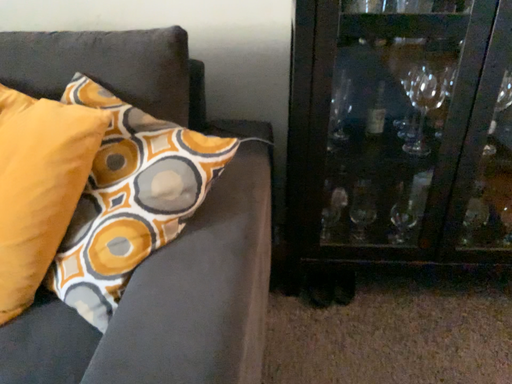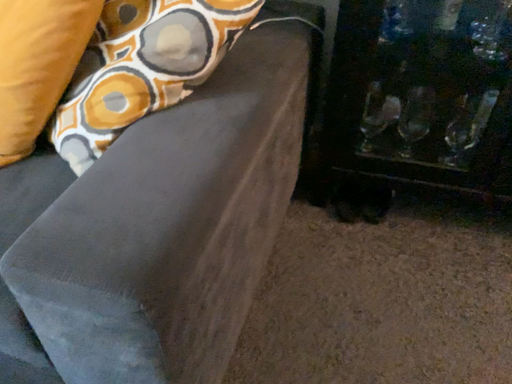
Question: Which way did the camera rotate in the video?

Choices:
 (A) rotated right
 (B) rotated left

Answer: (B)